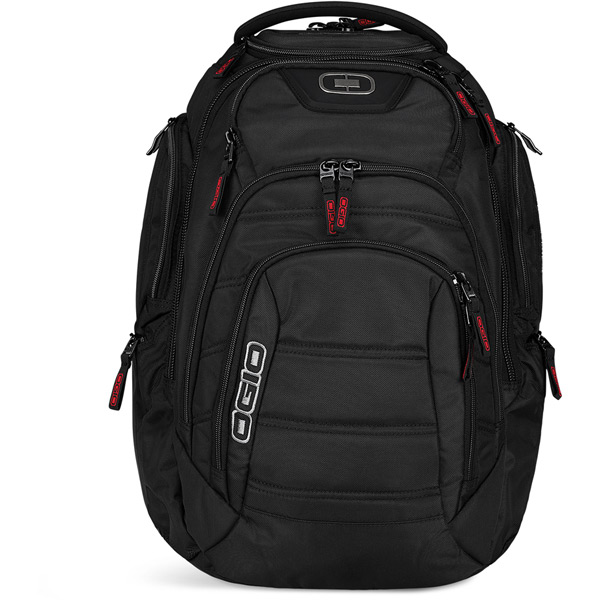
Find the location of a particular element. This screenshot has width=600, height=600. lower right compartment is located at coordinates (532, 397).